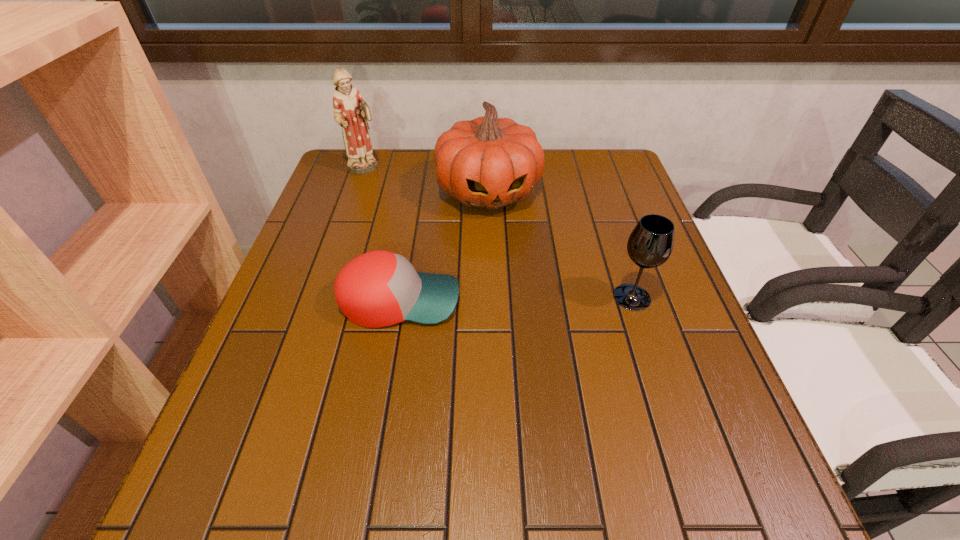
Locate an element on the screen. The height and width of the screenshot is (540, 960). vacant area at the near edge of the desktop is located at coordinates (404, 427).

The width and height of the screenshot is (960, 540). In the image, there is a desktop. In order to click on vacant space at the left edge in this screenshot , I will do `click(237, 388)`.

Locate an element on the screen. This screenshot has height=540, width=960. free space at the right edge of the desktop is located at coordinates (623, 268).

Where is `vacant space at the far left corner of the desktop`? vacant space at the far left corner of the desktop is located at coordinates (369, 191).

Locate an element on the screen. This screenshot has height=540, width=960. blank space at the far right corner of the desktop is located at coordinates (576, 168).

In the image, there is a desktop. Identify the location of vacant space at the near right corner. (681, 426).

This screenshot has width=960, height=540. I want to click on empty space that is in between the figurine and the rightmost object, so tap(498, 233).

You are a GUI agent. You are given a task and a screenshot of the screen. Output one action in this format:
    pyautogui.click(x=<x>, y=<y>)
    Task: Click on the free spot between the second shortest object and the pumpkin
    The height and width of the screenshot is (540, 960).
    Given the screenshot: What is the action you would take?
    560,244

What are the coordinates of `vacant point located between the figurine and the pumpkin` in the screenshot? It's located at (426, 180).

Locate an element on the screen. empty location between the shortest object and the pumpkin is located at coordinates (444, 246).